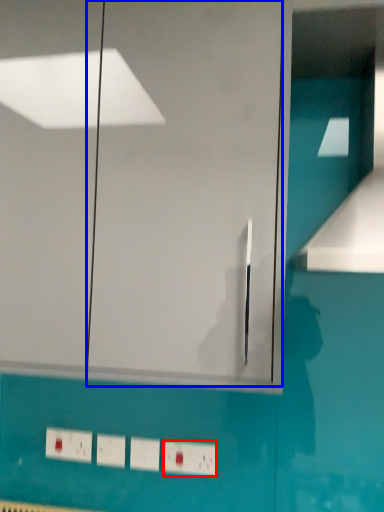
Question: Among these objects, which one is nearest to the camera, switch (highlighted by a red box) or glass door (highlighted by a blue box)?

Choices:
 (A) switch
 (B) glass door

Answer: (B)